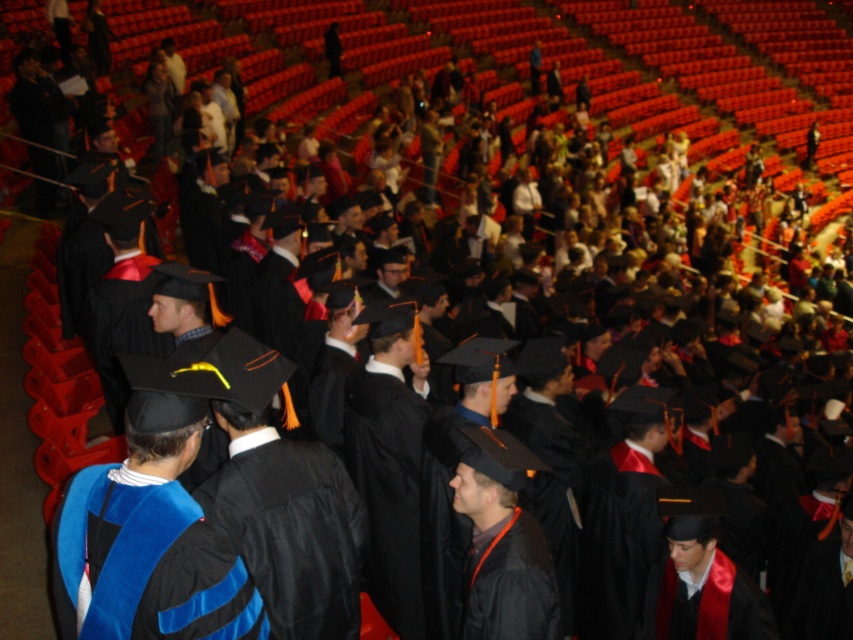
Which is below, black matte graduation gown at center or matte black graduation gown at center?

Positioned lower is black matte graduation gown at center.

You are a GUI agent. You are given a task and a screenshot of the screen. Output one action in this format:
    pyautogui.click(x=<x>, y=<y>)
    Task: Click on the black matte graduation gown at center
    
    Given the screenshot: What is the action you would take?
    pyautogui.click(x=292, y=531)

Is blue velvet graduation gown at center closer to camera compared to black matte graduation gown at center?

Yes, blue velvet graduation gown at center is in front of black matte graduation gown at center.

In the scene shown: Who is positioned more to the right, blue velvet graduation gown at center or black matte graduation gown at center?

From the viewer's perspective, black matte graduation gown at center appears more on the right side.

Where is `blue velvet graduation gown at center`? The width and height of the screenshot is (853, 640). blue velvet graduation gown at center is located at coordinates (148, 564).

Does blue velvet graduation gown at center appear under matte black graduation gown at center?

Actually, blue velvet graduation gown at center is above matte black graduation gown at center.

Does blue velvet graduation gown at center appear on the left side of matte black graduation gown at center?

Yes, blue velvet graduation gown at center is to the left of matte black graduation gown at center.

Does point (91, 518) come in front of point (473, 445)?

Yes, it is in front of point (473, 445).

Locate an element on the screen. blue velvet graduation gown at center is located at coordinates (148, 564).